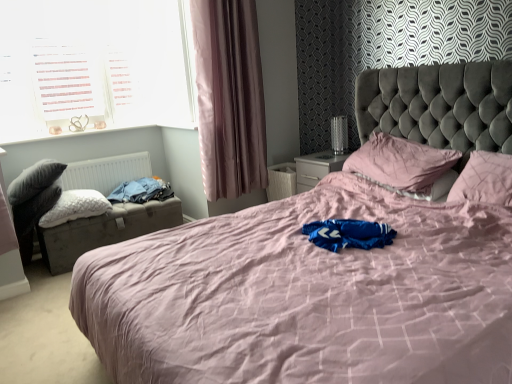
What do you see at coordinates (33, 200) in the screenshot? The image size is (512, 384). I see `dark grey fabric swivel chair at left` at bounding box center [33, 200].

Measure the distance between leatherette storage trunk at left and camera.

leatherette storage trunk at left is 2.93 meters from camera.

In order to face pink quilted pillow at upper right, the 1th pillow when ordered from right to left, should I rotate leftwards or rightwards?

Rotate your view right by about 29.005°.

In order to click on pink satin curtain at left in this screenshot , I will do `click(229, 97)`.

Considering the sizes of blue fabric at left and white fluffy pillow at left, which appears as the 1th pillow when viewed from the left, in the image, is blue fabric at left wider or thinner than white fluffy pillow at left, which appears as the 1th pillow when viewed from the left,?

In the image, blue fabric at left appears to be more narrow than white fluffy pillow at left, which appears as the 1th pillow when viewed from the left.

Do you think blue fabric at left is within white fluffy pillow at left, which appears as the 1th pillow when viewed from the left, or outside of it?

blue fabric at left exists outside the volume of white fluffy pillow at left, which appears as the 1th pillow when viewed from the left.

Find the location of a particular element. the 1st pillow in front of the blue fabric at left is located at coordinates (75, 207).

Does white plastic window at upper left have a lesser height compared to blue fabric at left?

No.

Considering the sizes of objects white plastic window at upper left and blue fabric at left in the image provided, who is thinner, white plastic window at upper left or blue fabric at left?

With smaller width is white plastic window at upper left.

Does point (141, 113) come farther from viewer compared to point (166, 190)?

Yes, point (141, 113) is farther from viewer.

Considering the relative positions of pink satin curtain at left and white plastic window at upper left in the image provided, is pink satin curtain at left to the left of white plastic window at upper left from the viewer's perspective?

No.

From a real-world perspective, which is physically below, pink satin curtain at left or white plastic window at upper left?

From a 3D spatial view, pink satin curtain at left is below.

Is the depth of pink satin curtain at left less than that of white plastic window at upper left?

Yes, the depth of pink satin curtain at left is less than that of white plastic window at upper left.

What's the angular difference between pink quilted pillow at upper right, the 1th pillow when ordered from right to left, and leatherette storage trunk at left's facing directions?

The facing directions of pink quilted pillow at upper right, the 1th pillow when ordered from right to left, and leatherette storage trunk at left are 89.6 degrees apart.

From the image's perspective, between pink quilted pillow at upper right, the 1th pillow when ordered from right to left, and leatherette storage trunk at left, who is located below?

leatherette storage trunk at left appears lower in the image.

Is pink quilted pillow at upper right, the 1th pillow when ordered from right to left, looking in the opposite direction of leatherette storage trunk at left?

No, pink quilted pillow at upper right, the 1th pillow when ordered from right to left,'s orientation is not away from leatherette storage trunk at left.

Is pink quilted pillow at upper right, which ranks as the 3th pillow in left-to-right order, at the right side of leatherette storage trunk at left?

Yes.

Is dark grey fabric swivel chair at left not close to pink satin curtain at left?

Indeed, dark grey fabric swivel chair at left is not near pink satin curtain at left.

Is pink satin curtain at left located within dark grey fabric swivel chair at left?

No, pink satin curtain at left is not surrounded by dark grey fabric swivel chair at left.

Which object is positioned more to the left, dark grey fabric swivel chair at left or pink satin curtain at left?

Positioned to the left is dark grey fabric swivel chair at left.

Which object is closer to the camera taking this photo, dark grey fabric swivel chair at left or pink satin curtain at left?

Positioned in front is dark grey fabric swivel chair at left.

Looking at this image, from their relative heights in the image, would you say pink fabric pillow at upper right, which is counted as the second pillow, starting from the right, is taller or shorter than pink quilted pillow at upper right, the 1th pillow when ordered from right to left?

pink fabric pillow at upper right, which is counted as the second pillow, starting from the right, is taller than pink quilted pillow at upper right, the 1th pillow when ordered from right to left.

Considering the relative sizes of pink fabric pillow at upper right, which is counted as the second pillow, starting from the right, and pink quilted pillow at upper right, which ranks as the 3th pillow in left-to-right order, in the image provided, is pink fabric pillow at upper right, which is counted as the second pillow, starting from the right, smaller than pink quilted pillow at upper right, which ranks as the 3th pillow in left-to-right order,?

No, pink fabric pillow at upper right, which is counted as the second pillow, starting from the right, is not smaller than pink quilted pillow at upper right, which ranks as the 3th pillow in left-to-right order.

Is the depth of pink fabric pillow at upper right, the second pillow viewed from the left, greater than that of pink quilted pillow at upper right, the 1th pillow when ordered from right to left?

That is True.

From the image's perspective, would you say pink fabric pillow at upper right, the second pillow viewed from the left, is positioned over pink quilted pillow at upper right, the 1th pillow when ordered from right to left?

Yes.

Consider the image. Is pink satin curtain at left positioned in front of pink quilted pillow at upper right, which ranks as the 3th pillow in left-to-right order?

No, pink satin curtain at left is behind pink quilted pillow at upper right, which ranks as the 3th pillow in left-to-right order.

Choose the correct answer: Is pink satin curtain at left inside pink quilted pillow at upper right, which ranks as the 3th pillow in left-to-right order, or outside it?

pink satin curtain at left lies outside pink quilted pillow at upper right, which ranks as the 3th pillow in left-to-right order.

Considering the relative sizes of pink satin curtain at left and pink quilted pillow at upper right, which ranks as the 3th pillow in left-to-right order, in the image provided, is pink satin curtain at left wider than pink quilted pillow at upper right, which ranks as the 3th pillow in left-to-right order,?

No, pink satin curtain at left is not wider than pink quilted pillow at upper right, which ranks as the 3th pillow in left-to-right order.

Is pink satin curtain at left not near pink quilted pillow at upper right, which ranks as the 3th pillow in left-to-right order?

That's right, there is a large distance between pink satin curtain at left and pink quilted pillow at upper right, which ranks as the 3th pillow in left-to-right order.

This screenshot has width=512, height=384. Identify the location of clothing that appears on the right of white fluffy pillow at left, which appears as the 1th pillow when viewed from the left. (141, 191).

The width and height of the screenshot is (512, 384). Identify the location of window in front of the blue fabric at left. (94, 66).

From the image, which object appears to be farther from pink fabric bed at center, white matte radiator at left or blue fabric at left?

white matte radiator at left.

Which object lies further to the anchor point pink quilted pillow at upper right, which ranks as the 3th pillow in left-to-right order, white matte radiator at left or dark grey fabric swivel chair at left?

Based on the image, white matte radiator at left appears to be further to pink quilted pillow at upper right, which ranks as the 3th pillow in left-to-right order.

In the scene shown: Estimate the real-world distances between objects in this image. Which object is closer to pink fabric pillow at upper right, which is counted as the second pillow, starting from the right, white matte radiator at left or dark grey fabric swivel chair at left?

Based on the image, white matte radiator at left appears to be nearer to pink fabric pillow at upper right, which is counted as the second pillow, starting from the right.

When comparing their distances from white matte radiator at left, does pink fabric pillow at upper right, which is counted as the second pillow, starting from the right, or white plastic window at upper left seem closer?

Among the two, white plastic window at upper left is located nearer to white matte radiator at left.

Considering their positions, is pink satin curtain at left positioned closer to blue fabric at left than white plastic window at upper left?

Based on the image, pink satin curtain at left appears to be nearer to blue fabric at left.

When comparing their distances from white fluffy pillow at left, arranged as the 3th pillow when viewed from the right, does white matte radiator at left or leatherette storage trunk at left seem further?

Among the two, white matte radiator at left is located further to white fluffy pillow at left, arranged as the 3th pillow when viewed from the right.

Considering their positions, is white matte radiator at left positioned further to pink satin curtain at left than white fluffy pillow at left, which appears as the 1th pillow when viewed from the left?

white fluffy pillow at left, which appears as the 1th pillow when viewed from the left, lies further to pink satin curtain at left than the other object.

Estimate the real-world distances between objects in this image. Which object is closer to leatherette storage trunk at left, white fluffy pillow at left, arranged as the 3th pillow when viewed from the right, or white plastic window at upper left?

white fluffy pillow at left, arranged as the 3th pillow when viewed from the right, lies closer to leatherette storage trunk at left than the other object.

The width and height of the screenshot is (512, 384). Find the location of `bed frame between pink fabric bed at center and white matte radiator at left along the z-axis`. bed frame between pink fabric bed at center and white matte radiator at left along the z-axis is located at coordinates (104, 231).

This screenshot has height=384, width=512. Find the location of `curtain between pink fabric bed at center and blue fabric at left from front to back`. curtain between pink fabric bed at center and blue fabric at left from front to back is located at coordinates (229, 97).

This screenshot has width=512, height=384. I want to click on pillow between dark grey fabric swivel chair at left and white matte radiator at left in the front-back direction, so click(75, 207).

You are a GUI agent. You are given a task and a screenshot of the screen. Output one action in this format:
    pyautogui.click(x=<x>, y=<y>)
    Task: Click on the bed frame between dark grey fabric swivel chair at left and pink fabric pillow at upper right, which is counted as the second pillow, starting from the right, in the horizontal direction
    
    Given the screenshot: What is the action you would take?
    pyautogui.click(x=104, y=231)